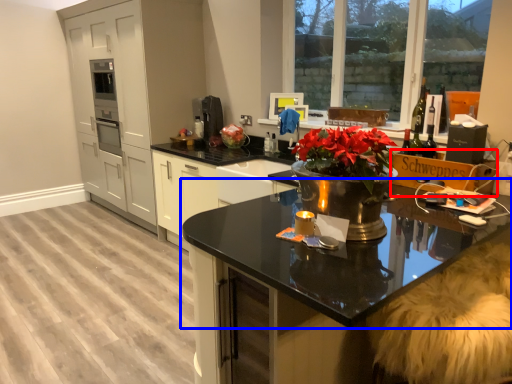
Question: Which object is closer to the camera taking this photo, cardboard box (highlighted by a red box) or countertop (highlighted by a blue box)?

Choices:
 (A) cardboard box
 (B) countertop

Answer: (B)